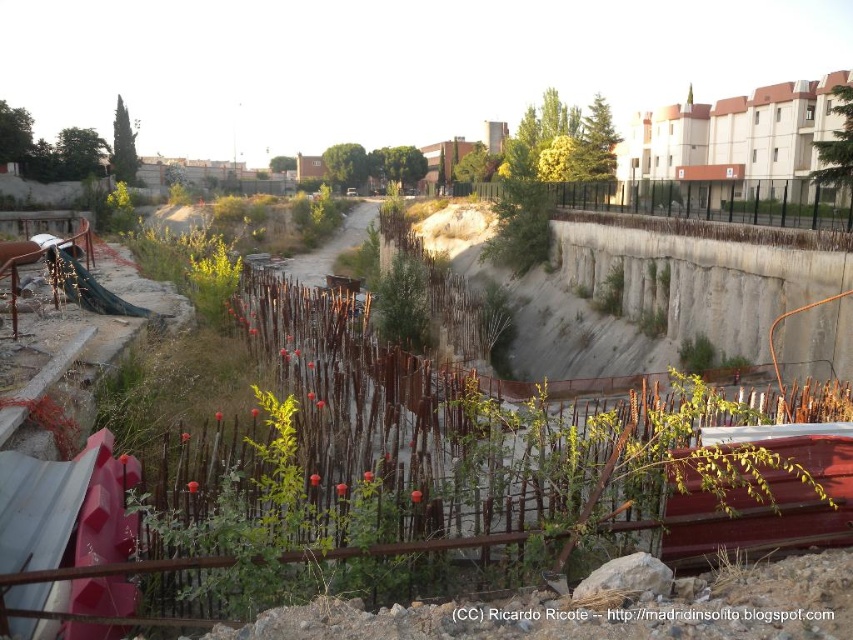
Is smooth concrete hillside at center positioned at the back of rustic wooden boat at lower right?

Yes, it is.

Does smooth concrete hillside at center have a smaller size compared to rustic wooden boat at lower right?

Actually, smooth concrete hillside at center might be larger than rustic wooden boat at lower right.

Locate an element on the screen. The image size is (853, 640). smooth concrete hillside at center is located at coordinates (694, 282).